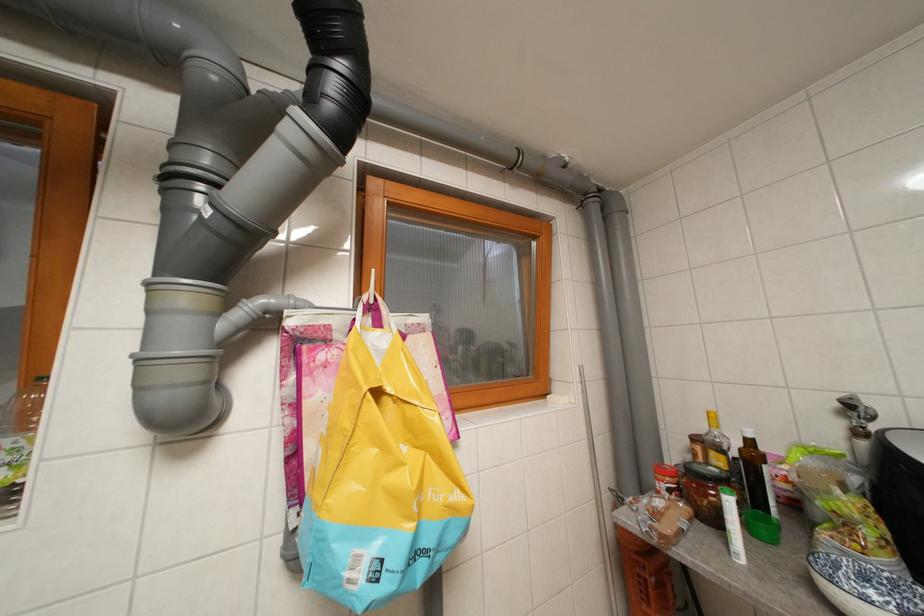
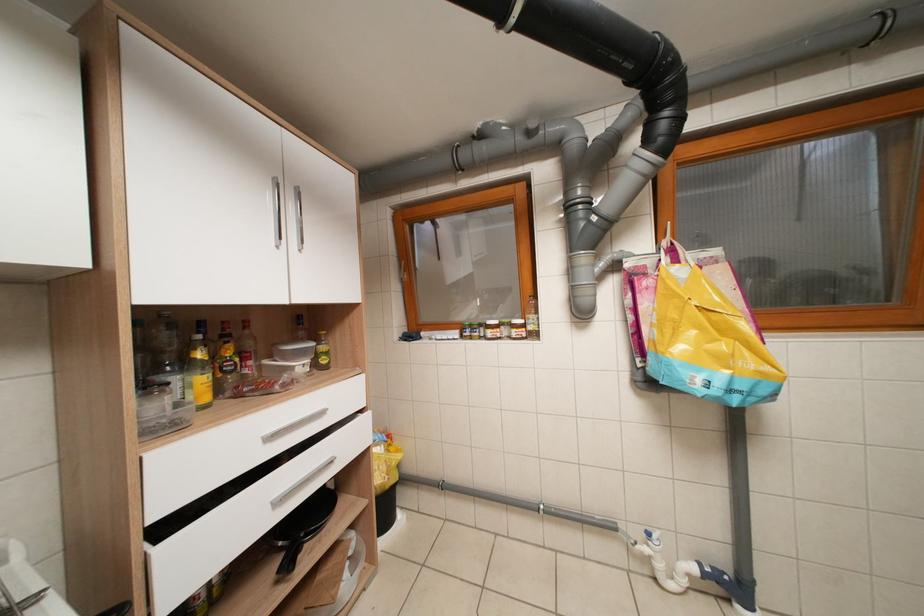
Question: The camera is either moving clockwise (left) or counter-clockwise (right) around the object. The first image is from the beginning of the video and the second image is from the end. Is the camera moving left or right when shooting the video?

Choices:
 (A) Left
 (B) Right

Answer: (B)